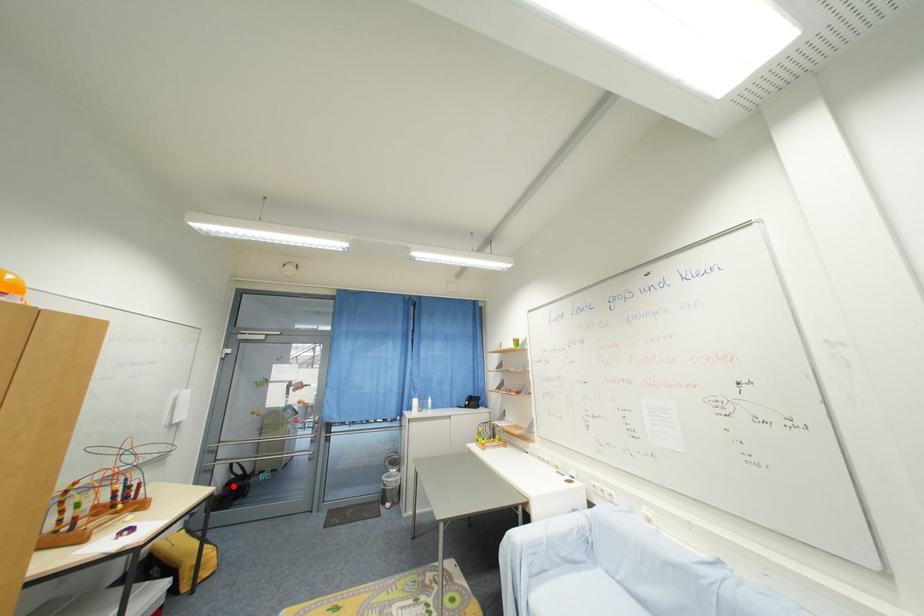
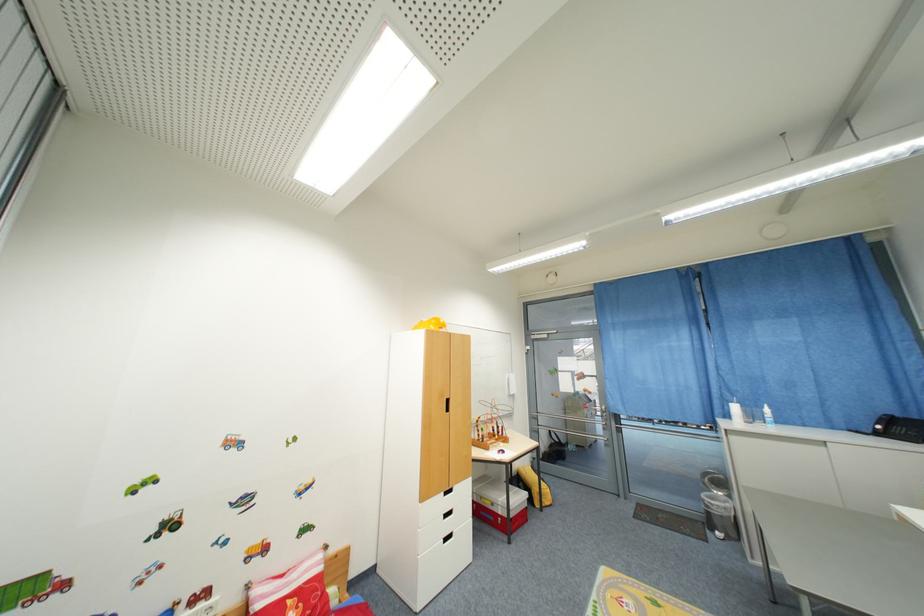
The point at the highlighted location is marked in the first image. Where is the corresponding point in the second image?

(555, 448)